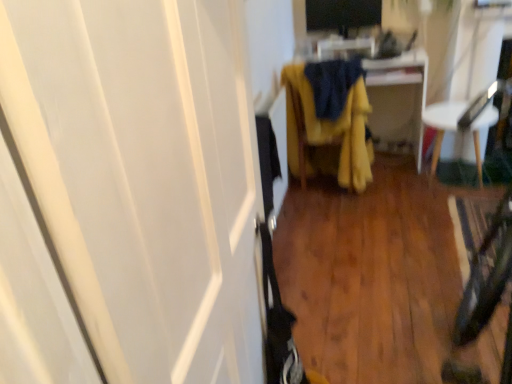
Question: Could you tell me if yellow fabric chair at center, which is the second furniture in right-to-left order, is facing white plastic chair at right, which is the first furniture in right-to-left order?

Choices:
 (A) no
 (B) yes

Answer: (A)

Question: Is yellow fabric chair at center, which is the second furniture in right-to-left order, positioned before white plastic chair at right, which is the first furniture in right-to-left order?

Choices:
 (A) no
 (B) yes

Answer: (B)

Question: Can you confirm if yellow fabric chair at center, which appears as the first furniture when viewed from the left, is smaller than white plastic chair at right, which is the 2th furniture from left to right?

Choices:
 (A) no
 (B) yes

Answer: (A)

Question: From a real-world perspective, is yellow fabric chair at center, which appears as the first furniture when viewed from the left, on white plastic chair at right, which is the 2th furniture from left to right?

Choices:
 (A) no
 (B) yes

Answer: (B)

Question: Can you confirm if yellow fabric chair at center, which is the second furniture in right-to-left order, is thinner than white plastic chair at right, which is the first furniture in right-to-left order?

Choices:
 (A) yes
 (B) no

Answer: (B)

Question: From the image's perspective, is yellow fabric chair at center, which is the second furniture in right-to-left order, located above white plastic chair at right, which is the 2th furniture from left to right?

Choices:
 (A) yes
 (B) no

Answer: (A)

Question: Is black glossy monitor at upper center completely or partially inside white plastic chair at right, which is the first furniture in right-to-left order?

Choices:
 (A) yes
 (B) no

Answer: (B)

Question: Is white plastic chair at right, which is the first furniture in right-to-left order, not within black glossy monitor at upper center?

Choices:
 (A) no
 (B) yes

Answer: (B)

Question: Considering the relative sizes of white plastic chair at right, which is the 2th furniture from left to right, and black glossy monitor at upper center in the image provided, is white plastic chair at right, which is the 2th furniture from left to right, wider than black glossy monitor at upper center?

Choices:
 (A) yes
 (B) no

Answer: (A)

Question: Considering the relative sizes of white plastic chair at right, which is the first furniture in right-to-left order, and black glossy monitor at upper center in the image provided, is white plastic chair at right, which is the first furniture in right-to-left order, thinner than black glossy monitor at upper center?

Choices:
 (A) no
 (B) yes

Answer: (A)

Question: Is the depth of white plastic chair at right, which is the 2th furniture from left to right, less than that of black glossy monitor at upper center?

Choices:
 (A) yes
 (B) no

Answer: (A)

Question: Does white plastic chair at right, which is the 2th furniture from left to right, have a greater height compared to black glossy monitor at upper center?

Choices:
 (A) no
 (B) yes

Answer: (B)

Question: Is black glossy monitor at upper center outside of white glossy screen door at left?

Choices:
 (A) yes
 (B) no

Answer: (A)